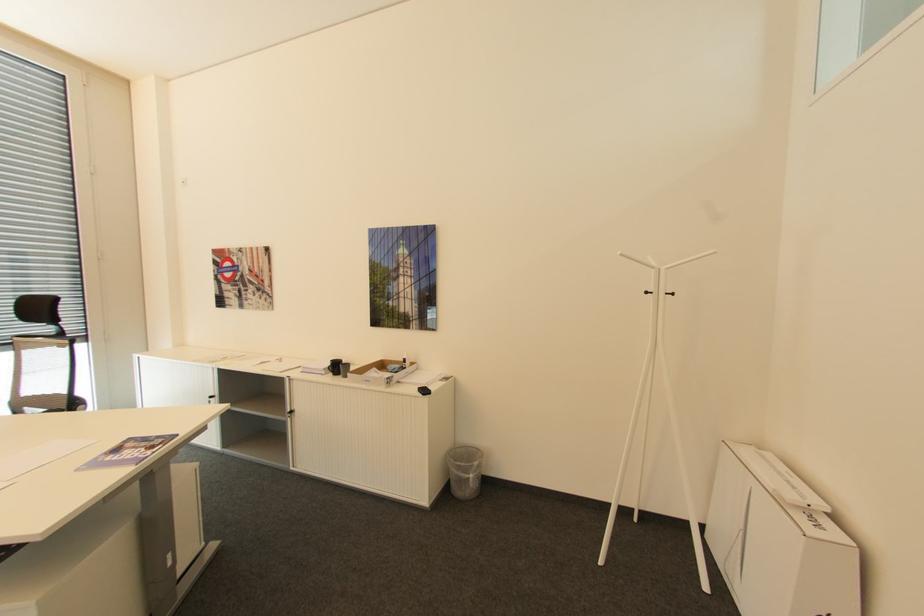
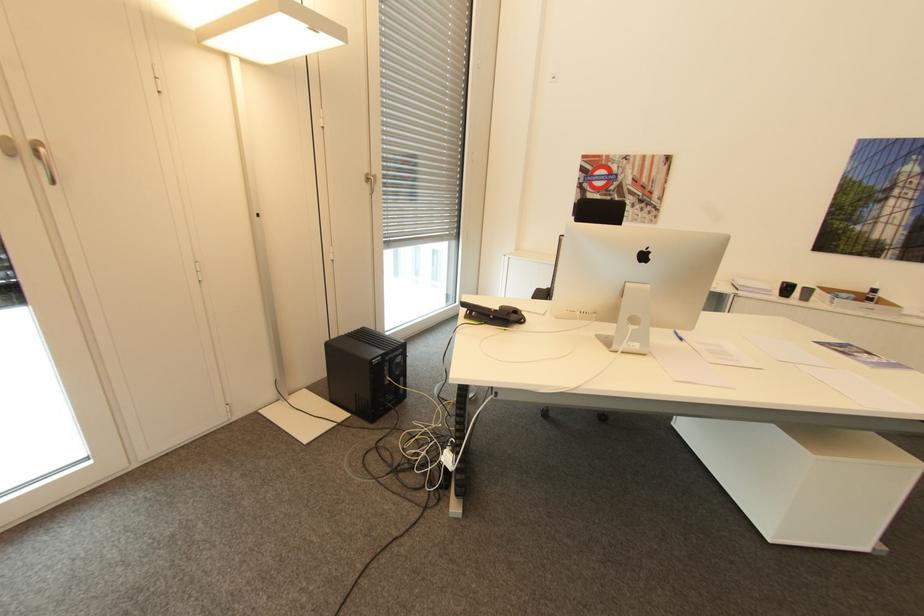
The point at (336, 360) is marked in the first image. Where is the corresponding point in the second image?

(788, 283)